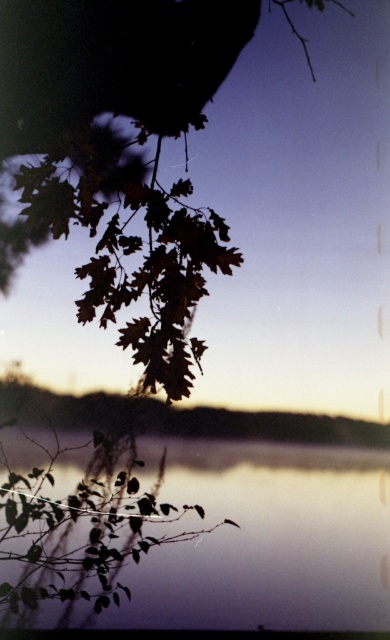
You are standing in the scene and want to place a small floating lantern on the silvery reflective water at bottom center. Will the brown leafy branch at upper left cast a shadow on the lantern?

The brown leafy branch at upper left is located above the silvery reflective water at bottom center, so it will cast a shadow on the lantern if the light source is coming from behind the branch.

You are an artist trying to sketch this scene. You want to ensure the proportions between the brown leafy branch at upper left and the silvery reflective water at bottom center are accurate. Which one should you draw first to maintain the correct size relationship?

You should draw the brown leafy branch at upper left first because it is much taller than the silvery reflective water at bottom center, so establishing its height will help in scaling the water accordingly.

You are an artist trying to paint the scene. You want to ensure the brown leafy branch at upper left and the silvery reflective water at bottom center are proportionally accurate. Which object should you paint larger?

The brown leafy branch at upper left should be painted larger since it has a larger size compared to the silvery reflective water at bottom center according to the description.